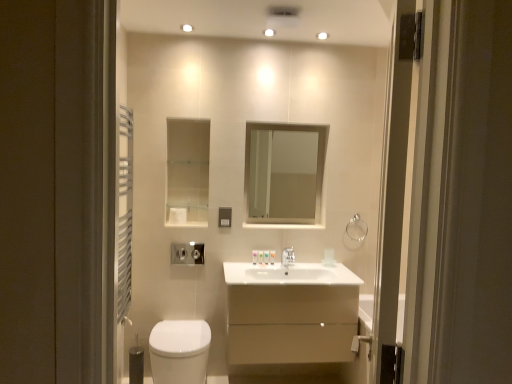
Question: Could you tell me if satin nickel light switch at upper center is facing transparent glass screen door at right?

Choices:
 (A) yes
 (B) no

Answer: (A)

Question: Does satin nickel light switch at upper center have a lesser width compared to transparent glass screen door at right?

Choices:
 (A) no
 (B) yes

Answer: (B)

Question: From a real-world perspective, is satin nickel light switch at upper center under transparent glass screen door at right?

Choices:
 (A) no
 (B) yes

Answer: (B)

Question: From the image's perspective, is satin nickel light switch at upper center located beneath transparent glass screen door at right?

Choices:
 (A) no
 (B) yes

Answer: (B)

Question: Is satin nickel light switch at upper center directly adjacent to transparent glass screen door at right?

Choices:
 (A) no
 (B) yes

Answer: (A)

Question: From the image's perspective, is satin nickel light switch at upper center on top of transparent glass screen door at right?

Choices:
 (A) yes
 (B) no

Answer: (B)

Question: Is the depth of transparent glass screen door at right less than that of white matte toilet paper at center?

Choices:
 (A) yes
 (B) no

Answer: (A)

Question: Is transparent glass screen door at right facing towards white matte toilet paper at center?

Choices:
 (A) yes
 (B) no

Answer: (B)

Question: Is transparent glass screen door at right smaller than white matte toilet paper at center?

Choices:
 (A) no
 (B) yes

Answer: (A)

Question: Are transparent glass screen door at right and white matte toilet paper at center located far from each other?

Choices:
 (A) no
 (B) yes

Answer: (B)

Question: Is transparent glass screen door at right positioned with its back to white matte toilet paper at center?

Choices:
 (A) yes
 (B) no

Answer: (B)

Question: From a real-world perspective, is transparent glass screen door at right beneath white matte toilet paper at center?

Choices:
 (A) no
 (B) yes

Answer: (A)

Question: Can you confirm if white glossy sink at center is thinner than translucent plastic soap at center, which ranks as the second toiletry in right-to-left order?

Choices:
 (A) yes
 (B) no

Answer: (B)